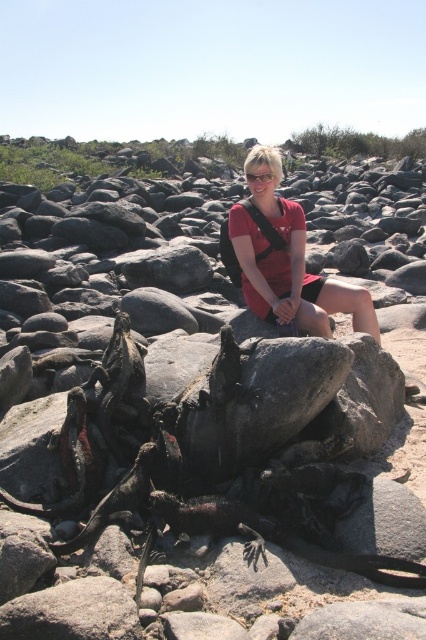
Can you confirm if matte red dress at center is bigger than clear plastic goggles at center?

Correct, matte red dress at center is larger in size than clear plastic goggles at center.

Between matte red dress at center and clear plastic goggles at center, which one is positioned higher?

clear plastic goggles at center is above.

Does point (241, 250) come closer to viewer compared to point (250, 177)?

Yes, it is.

What are the coordinates of `matte red dress at center` in the screenshot? It's located at (287, 260).